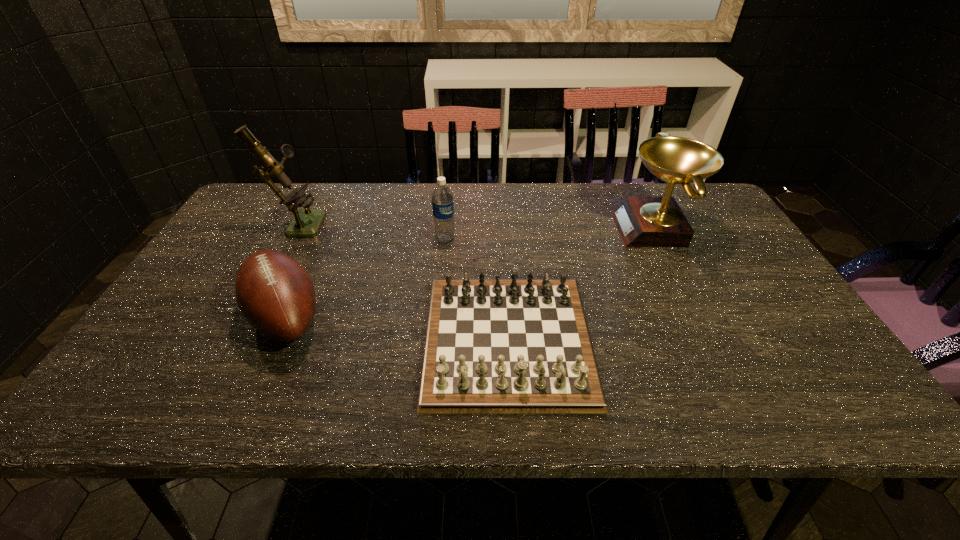
I want to click on free space between the fourth shortest object and the fourth tallest object, so click(470, 273).

Find the location of a particular element. object that is the third closest to the football (American) is located at coordinates (442, 198).

Image resolution: width=960 pixels, height=540 pixels. In order to click on object that is the closest to the shortest object in this screenshot , I will do point(442,198).

Where is `vacant space that satisfies the following two spatial constraints: 1. on the back side of the third tallest object; 2. at the eyepiece of the tallest object`? The image size is (960, 540). vacant space that satisfies the following two spatial constraints: 1. on the back side of the third tallest object; 2. at the eyepiece of the tallest object is located at coordinates (446, 223).

This screenshot has width=960, height=540. Identify the location of free space in the image that satisfies the following two spatial constraints: 1. on the front-facing side of the rightmost object; 2. on the front side of the water bottle. (660, 239).

Find the location of a particular element. vacant space that satisfies the following two spatial constraints: 1. at the eyepiece of the microscope; 2. on the right side of the third shortest object is located at coordinates (289, 239).

Where is `vacant region that satisfies the following two spatial constraints: 1. on the front-facing side of the rightmost object; 2. from the player's perspective of the shortest object`? This screenshot has width=960, height=540. vacant region that satisfies the following two spatial constraints: 1. on the front-facing side of the rightmost object; 2. from the player's perspective of the shortest object is located at coordinates (710, 340).

In order to click on free location that satisfies the following two spatial constraints: 1. at the eyepiece of the tallest object; 2. on the right side of the football (American) in this screenshot , I will do `click(248, 317)`.